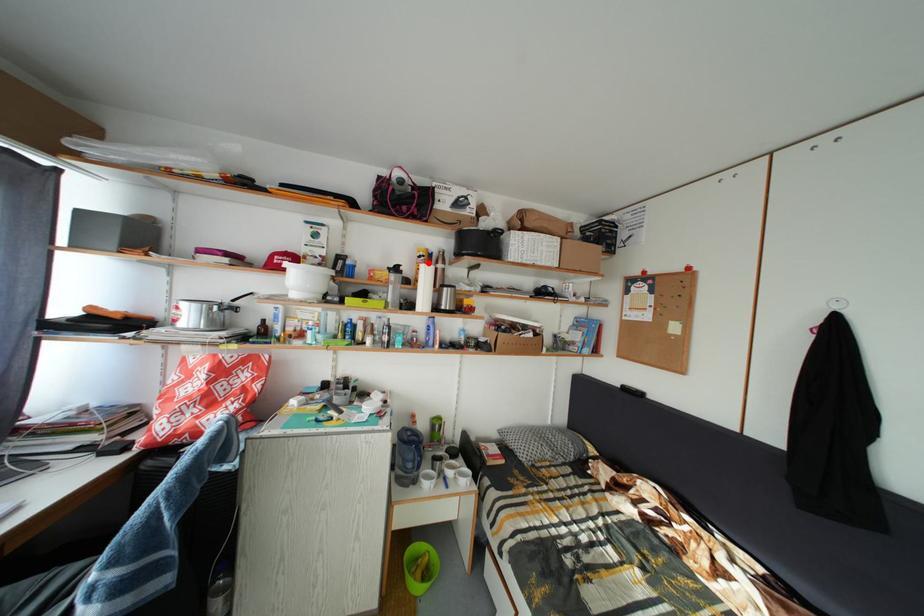
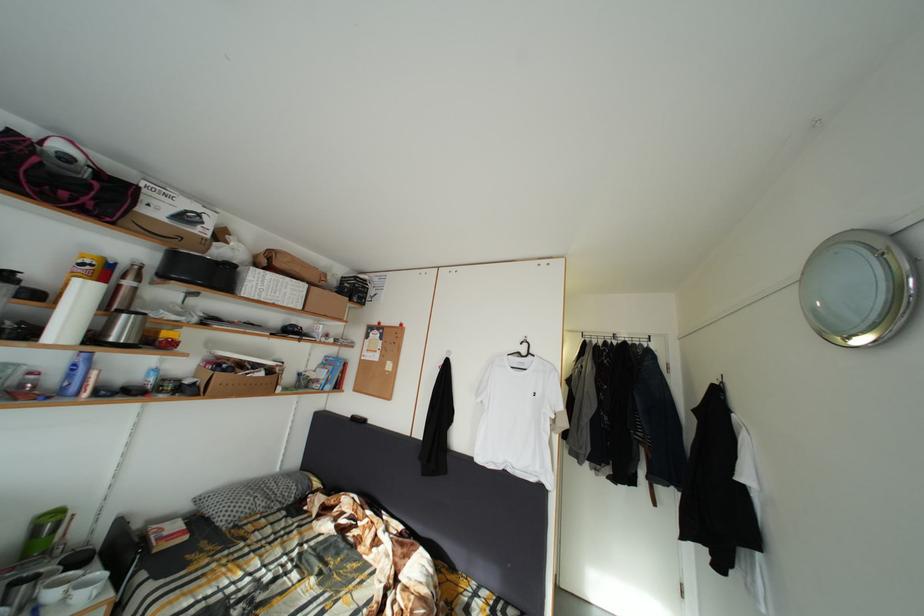
Find the pixel in the second image that matches the highlighted location in the first image.

(91, 270)